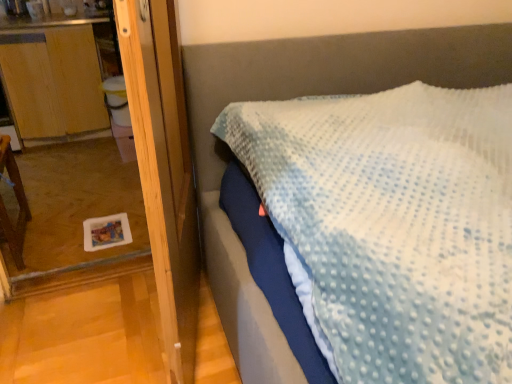
Question: Is wooden dresser at left smaller than wooden screen door at left?

Choices:
 (A) no
 (B) yes

Answer: (A)

Question: Considering the relative sizes of wooden dresser at left and wooden screen door at left in the image provided, is wooden dresser at left bigger than wooden screen door at left?

Choices:
 (A) no
 (B) yes

Answer: (B)

Question: Is wooden screen door at left completely or partially inside wooden dresser at left?

Choices:
 (A) no
 (B) yes

Answer: (A)

Question: From a real-world perspective, does wooden dresser at left sit lower than wooden screen door at left?

Choices:
 (A) no
 (B) yes

Answer: (B)

Question: From the image's perspective, is wooden dresser at left on wooden screen door at left?

Choices:
 (A) no
 (B) yes

Answer: (B)

Question: Would you say brown wooden chair at left is inside or outside wooden dresser at left?

Choices:
 (A) outside
 (B) inside

Answer: (A)

Question: Considering the positions of brown wooden chair at left and wooden dresser at left in the image, is brown wooden chair at left bigger or smaller than wooden dresser at left?

Choices:
 (A) big
 (B) small

Answer: (B)

Question: From the image's perspective, relative to wooden dresser at left, is brown wooden chair at left above or below?

Choices:
 (A) below
 (B) above

Answer: (A)

Question: From a real-world perspective, is brown wooden chair at left physically located above or below wooden dresser at left?

Choices:
 (A) above
 (B) below

Answer: (B)

Question: Does point (36, 135) appear closer or farther from the camera than point (161, 279)?

Choices:
 (A) closer
 (B) farther

Answer: (B)

Question: From a real-world perspective, is wooden dresser at left above or below wooden screen door at left?

Choices:
 (A) below
 (B) above

Answer: (A)

Question: Is wooden dresser at left bigger or smaller than wooden screen door at left?

Choices:
 (A) small
 (B) big

Answer: (B)

Question: Is wooden dresser at left taller or shorter than wooden screen door at left?

Choices:
 (A) short
 (B) tall

Answer: (A)

Question: In the image, is wooden dresser at left on the left side or the right side of brown wooden chair at left?

Choices:
 (A) right
 (B) left

Answer: (B)

Question: Looking at the image, does wooden dresser at left seem bigger or smaller compared to brown wooden chair at left?

Choices:
 (A) small
 (B) big

Answer: (B)